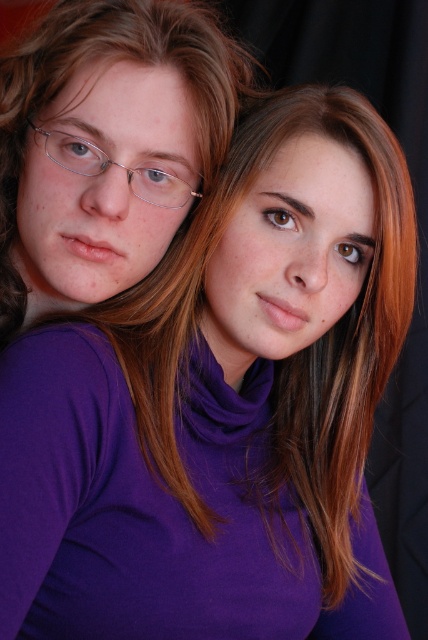
Question: Which object appears closest to the camera in this image?

Choices:
 (A) matte purple turtleneck at center
 (B) clear plastic glasses at upper left

Answer: (A)

Question: Is matte purple turtleneck at center positioned in front of clear plastic glasses at upper left?

Choices:
 (A) no
 (B) yes

Answer: (B)

Question: Does matte purple turtleneck at center have a greater width compared to clear plastic glasses at upper left?

Choices:
 (A) yes
 (B) no

Answer: (A)

Question: Observing the image, what is the correct spatial positioning of matte purple turtleneck at center in reference to clear plastic glasses at upper left?

Choices:
 (A) below
 (B) above

Answer: (B)

Question: Which object appears closest to the camera in this image?

Choices:
 (A) clear plastic glasses at upper left
 (B) matte purple turtleneck at center

Answer: (B)